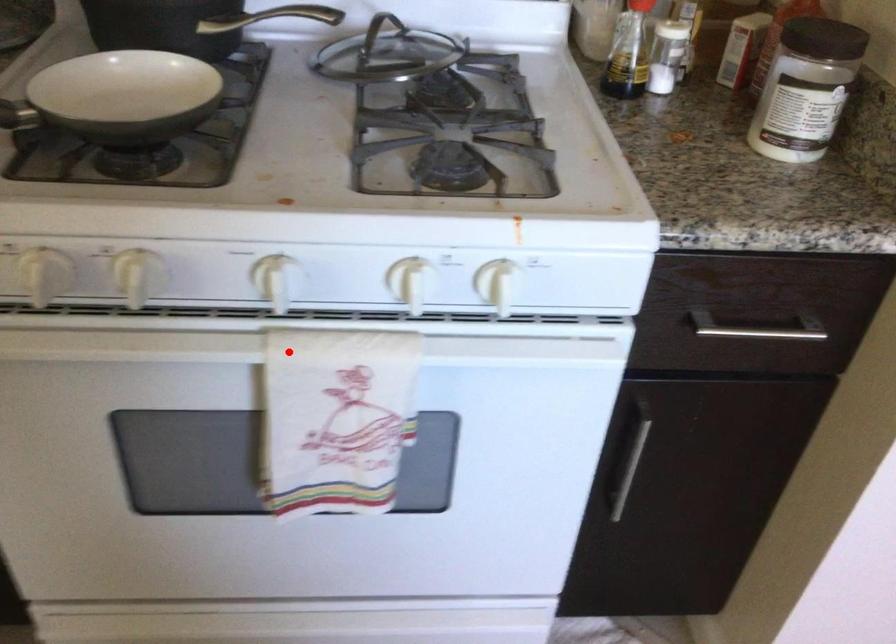
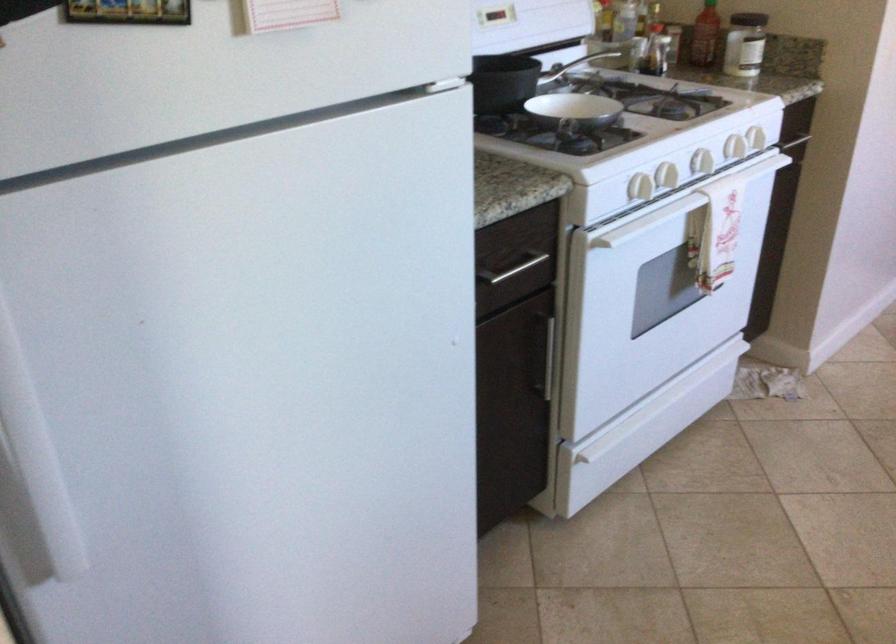
Question: I am providing you with two images of the same scene from different viewpoints. In image1, a red point is highlighted. Considering the same 3D point in image2, which of the following is correct?

Choices:
 (A) It is closer
 (B) It is farther

Answer: (B)